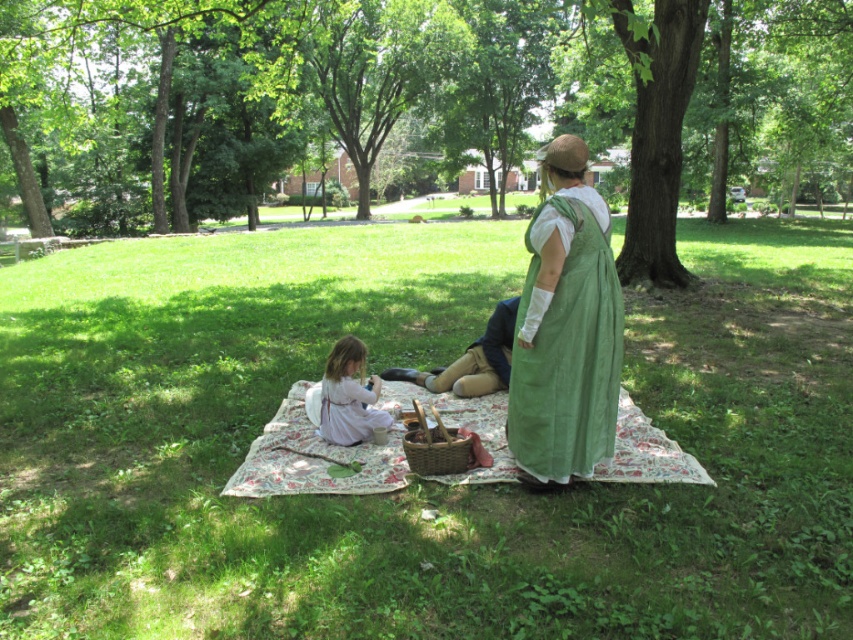
Does green fabric dress at center have a lesser width compared to pale pink fabric at lower left?

Yes, green fabric dress at center is thinner than pale pink fabric at lower left.

Can you confirm if green fabric dress at center is shorter than pale pink fabric at lower left?

Yes, green fabric dress at center is shorter than pale pink fabric at lower left.

Identify the location of green fabric dress at center. [566, 330].

Identify the location of green fabric dress at center. This screenshot has width=853, height=640. (566, 330).

Between white cotton cloth at center and brown woven picnic basket at center, which one has more height?

Standing taller between the two is white cotton cloth at center.

Is point (643, 416) more distant than point (439, 426)?

Yes, it is behind point (439, 426).

You are a GUI agent. You are given a task and a screenshot of the screen. Output one action in this format:
    pyautogui.click(x=<x>, y=<y>)
    Task: Click on the white cotton cloth at center
    Image resolution: width=853 pixels, height=640 pixels.
    Given the screenshot: What is the action you would take?
    pyautogui.click(x=312, y=458)

Does point (364, 388) come in front of point (437, 426)?

No, it is behind (437, 426).

Who is shorter, pale pink fabric at lower left or brown woven picnic basket at center?

With less height is brown woven picnic basket at center.

Does point (354, 339) lie behind point (416, 452)?

Yes, it is.

You are a GUI agent. You are given a task and a screenshot of the screen. Output one action in this format:
    pyautogui.click(x=<x>, y=<y>)
    Task: Click on the pale pink fabric at lower left
    The height and width of the screenshot is (640, 853).
    Given the screenshot: What is the action you would take?
    pyautogui.click(x=347, y=396)